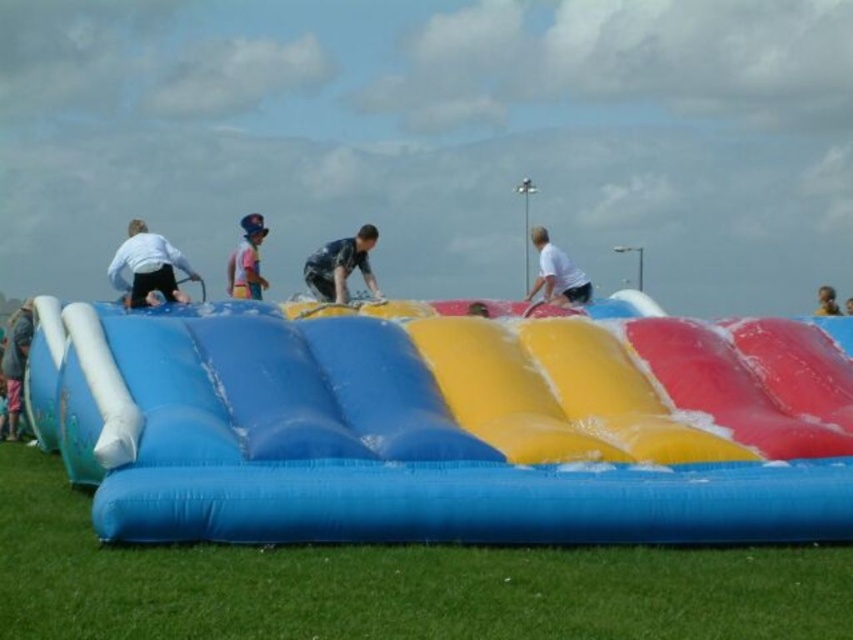
Between point (844, 592) and point (845, 312), which one is positioned behind?

Positioned behind is point (845, 312).

Is green grass at lower center in front of smooth yellow shirt at center?

Yes, it is in front of smooth yellow shirt at center.

Who is more forward, (753, 628) or (848, 314)?

Positioned in front is point (753, 628).

You are a GUI agent. You are given a task and a screenshot of the screen. Output one action in this format:
    pyautogui.click(x=<x>, y=<y>)
    Task: Click on the green grass at lower center
    
    Given the screenshot: What is the action you would take?
    pyautogui.click(x=387, y=582)

Is blue inflatable slide at center in front of matte white shorts at left?

Yes, blue inflatable slide at center is closer to the viewer.

Is blue inflatable slide at center further to camera compared to matte white shorts at left?

No, it is in front of matte white shorts at left.

Between point (30, 368) and point (154, 289), which one is positioned behind?

The point (154, 289) is more distant.

The image size is (853, 640). What are the coordinates of `blue inflatable slide at center` in the screenshot? It's located at (445, 426).

Which is in front, point (136, 259) or point (848, 312)?

Positioned in front is point (136, 259).

Does matte white shorts at left have a larger size compared to smooth yellow shirt at center?

Correct, matte white shorts at left is larger in size than smooth yellow shirt at center.

The width and height of the screenshot is (853, 640). What are the coordinates of `matte white shorts at left` in the screenshot? It's located at (146, 266).